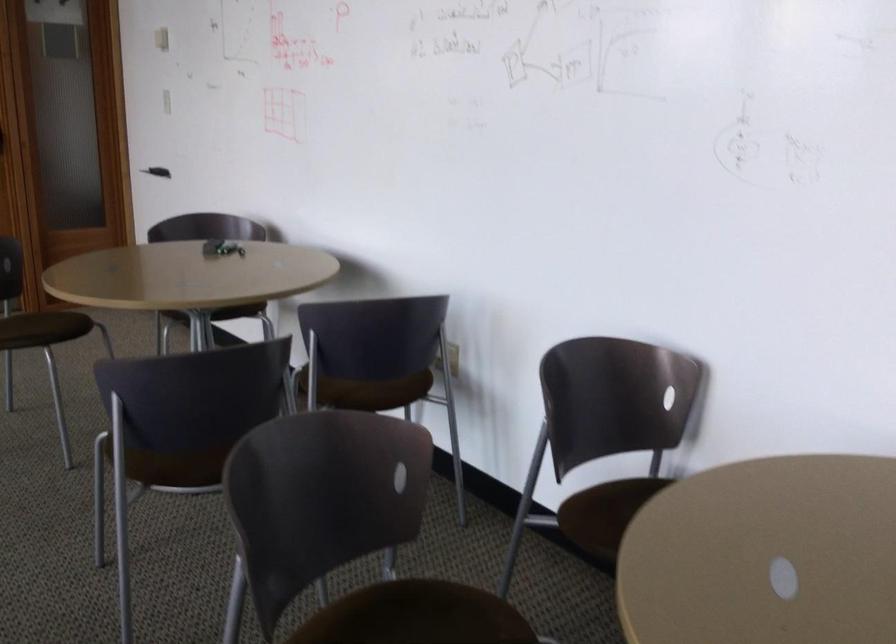
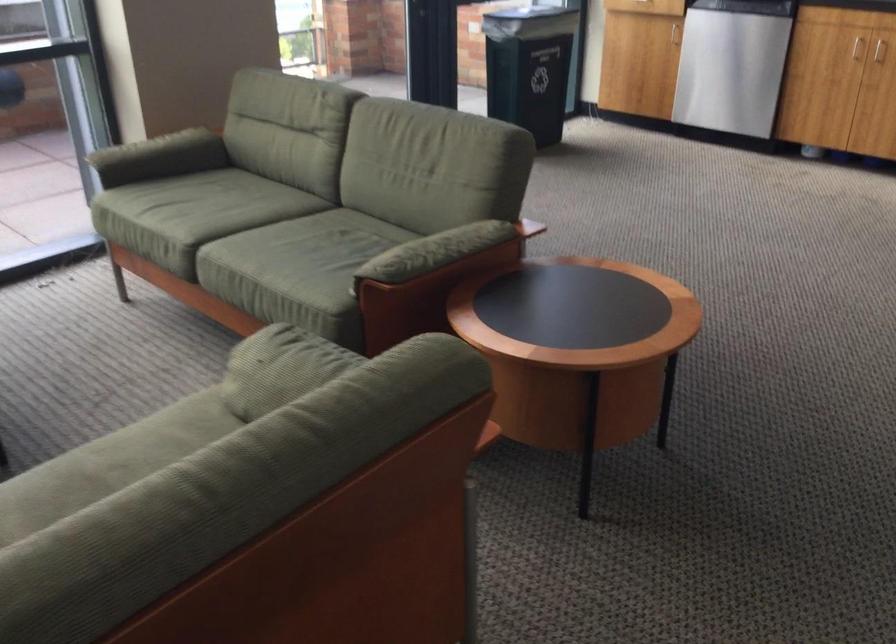
How did the camera likely rotate?

The camera rotated toward left-down.